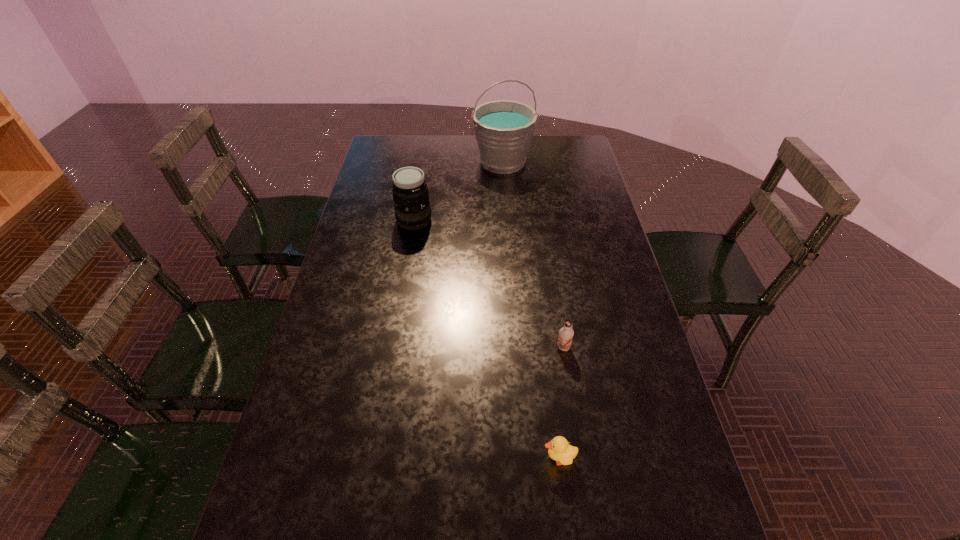
Find the location of `vacant space located 0.370m on the back of the second nearest object`. vacant space located 0.370m on the back of the second nearest object is located at coordinates (548, 249).

This screenshot has width=960, height=540. Find the location of `vacant space located on the front-facing side of the duckling`. vacant space located on the front-facing side of the duckling is located at coordinates (366, 458).

This screenshot has width=960, height=540. Find the location of `free space located 0.280m on the front-facing side of the duckling`. free space located 0.280m on the front-facing side of the duckling is located at coordinates (416, 458).

At what (x,y) coordinates should I click in order to perform the action: click on vacant point located on the front-facing side of the duckling. Please return your answer as a coordinate pair (x, y). Looking at the image, I should click on (461, 458).

The image size is (960, 540). In order to click on object at the far edge in this screenshot , I will do `click(504, 129)`.

I want to click on object that is at the left edge, so click(x=410, y=193).

Where is `blank space at the far edge`? The height and width of the screenshot is (540, 960). blank space at the far edge is located at coordinates (460, 138).

I want to click on vacant area at the left edge of the desktop, so click(325, 429).

The image size is (960, 540). Identify the location of vacant space at the right edge. (615, 245).

You are a GUI agent. You are given a task and a screenshot of the screen. Output one action in this format:
    pyautogui.click(x=<x>, y=<y>)
    Task: Click on the vacant area at the far left corner
    This screenshot has height=540, width=960.
    Given the screenshot: What is the action you would take?
    pyautogui.click(x=412, y=145)